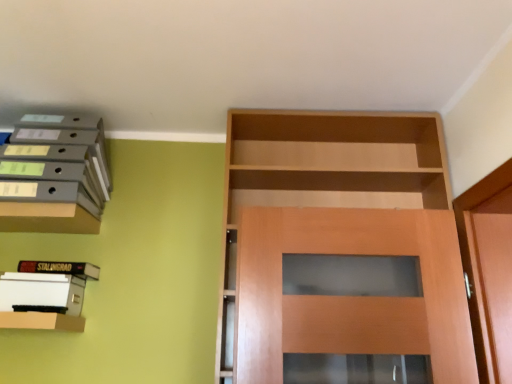
Question: Can you confirm if hardcover book at upper left, which appears as the 1th book when viewed from the top, is bigger than matte wood shelf at upper left?

Choices:
 (A) yes
 (B) no

Answer: (B)

Question: Is hardcover book at upper left, placed as the 2th book when sorted from bottom to top, smaller than matte wood shelf at upper left?

Choices:
 (A) yes
 (B) no

Answer: (A)

Question: From a real-world perspective, is hardcover book at upper left, which appears as the 1th book when viewed from the top, over matte wood shelf at upper left?

Choices:
 (A) no
 (B) yes

Answer: (A)

Question: From the image's perspective, would you say hardcover book at upper left, placed as the 2th book when sorted from bottom to top, is positioned over matte wood shelf at upper left?

Choices:
 (A) yes
 (B) no

Answer: (B)

Question: Is hardcover book at upper left, placed as the 2th book when sorted from bottom to top, shorter than matte wood shelf at upper left?

Choices:
 (A) yes
 (B) no

Answer: (A)

Question: Considering their positions, is hardcover book at upper left, which appears as the 1th book when viewed from the top, located in front of or behind matte wood shelf at upper left?

Choices:
 (A) behind
 (B) front

Answer: (A)

Question: Is hardcover book at upper left, placed as the 2th book when sorted from bottom to top, to the left or to the right of matte wood shelf at upper left in the image?

Choices:
 (A) right
 (B) left

Answer: (A)

Question: From their relative heights in the image, would you say hardcover book at upper left, placed as the 2th book when sorted from bottom to top, is taller or shorter than matte wood shelf at upper left?

Choices:
 (A) tall
 (B) short

Answer: (B)

Question: Considering the positions of hardcover book at upper left, which appears as the 1th book when viewed from the top, and matte wood shelf at upper left in the image, is hardcover book at upper left, which appears as the 1th book when viewed from the top, wider or thinner than matte wood shelf at upper left?

Choices:
 (A) thin
 (B) wide

Answer: (A)

Question: In the image, is white paper at left, positioned as the 2th book in top-to-bottom order, positioned in front of or behind matte wood shelf at lower left, the 1th shelf positioned from the bottom?

Choices:
 (A) front
 (B) behind

Answer: (B)

Question: Considering the positions of white paper at left, positioned as the 2th book in top-to-bottom order, and matte wood shelf at lower left, the 1th shelf positioned from the bottom, in the image, is white paper at left, positioned as the 2th book in top-to-bottom order, taller or shorter than matte wood shelf at lower left, the 1th shelf positioned from the bottom,?

Choices:
 (A) tall
 (B) short

Answer: (A)

Question: From a real-world perspective, is white paper at left, positioned as the 2th book in top-to-bottom order, above or below matte wood shelf at lower left, the 1th shelf positioned from the bottom?

Choices:
 (A) below
 (B) above

Answer: (B)

Question: Is point (10, 301) positioned closer to the camera than point (38, 324)?

Choices:
 (A) closer
 (B) farther

Answer: (B)

Question: In terms of height, does matte gray folders at upper left, marked as the 2th shelf in a bottom-to-top arrangement, look taller or shorter compared to hardcover book at upper left, placed as the 2th book when sorted from bottom to top?

Choices:
 (A) short
 (B) tall

Answer: (B)

Question: Considering the positions of matte gray folders at upper left, marked as the 2th shelf in a bottom-to-top arrangement, and hardcover book at upper left, which appears as the 1th book when viewed from the top, in the image, is matte gray folders at upper left, marked as the 2th shelf in a bottom-to-top arrangement, wider or thinner than hardcover book at upper left, which appears as the 1th book when viewed from the top,?

Choices:
 (A) wide
 (B) thin

Answer: (A)